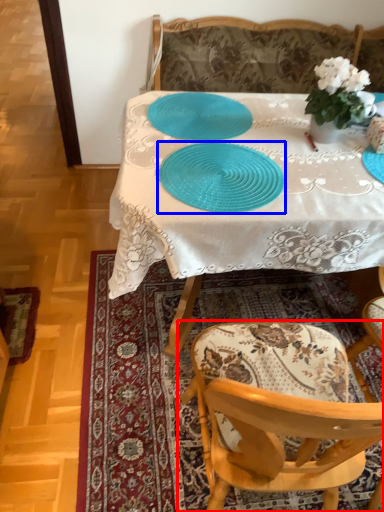
Question: Which object is further to the camera taking this photo, chair (highlighted by a red box) or tableware (highlighted by a blue box)?

Choices:
 (A) chair
 (B) tableware

Answer: (B)